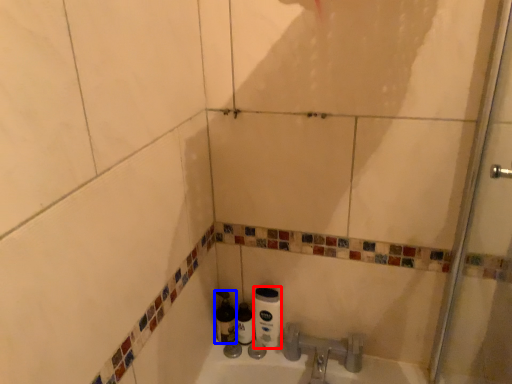
Question: Which object is further to the camera taking this photo, toilet paper (highlighted by a red box) or bottle (highlighted by a blue box)?

Choices:
 (A) toilet paper
 (B) bottle

Answer: (B)